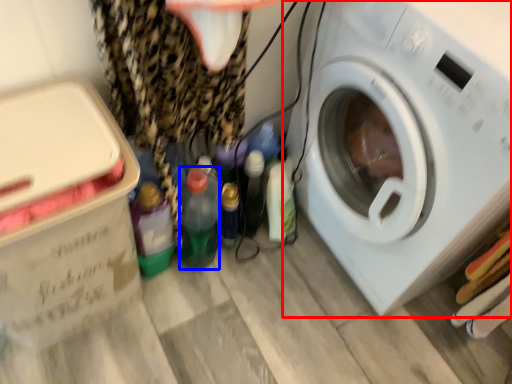
Question: Which object is further to the camera taking this photo, washing machine (highlighted by a red box) or bottle (highlighted by a blue box)?

Choices:
 (A) washing machine
 (B) bottle

Answer: (B)